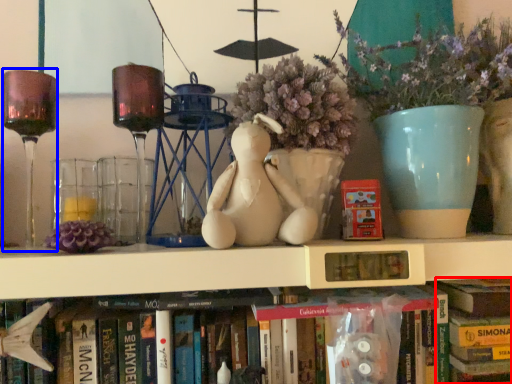
Question: Among these objects, which one is nearest to the camera, book (highlighted by a red box) or wine glass (highlighted by a blue box)?

Choices:
 (A) book
 (B) wine glass

Answer: (B)